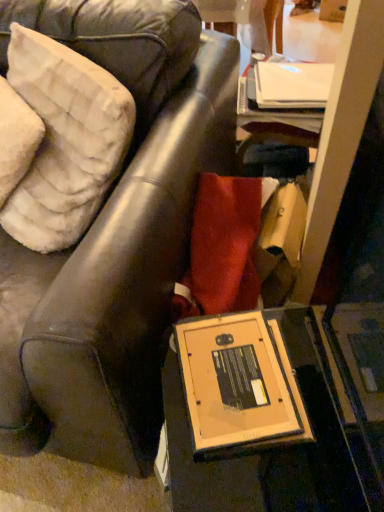
Question: Does white plush pillow at upper left, which is the 1th pillow from right to left, have a lesser width compared to white fluffy pillow at upper left, the second pillow when ordered from right to left?

Choices:
 (A) no
 (B) yes

Answer: (A)

Question: From the image's perspective, is white plush pillow at upper left, the second pillow in the left-to-right sequence, below white fluffy pillow at upper left, the first pillow viewed from the left?

Choices:
 (A) yes
 (B) no

Answer: (B)

Question: Does white plush pillow at upper left, which is the 1th pillow from right to left, lie behind white fluffy pillow at upper left, the first pillow viewed from the left?

Choices:
 (A) no
 (B) yes

Answer: (A)

Question: Are white plush pillow at upper left, the second pillow in the left-to-right sequence, and white fluffy pillow at upper left, the second pillow when ordered from right to left, making contact?

Choices:
 (A) no
 (B) yes

Answer: (B)

Question: Considering the relative sizes of white plush pillow at upper left, the second pillow in the left-to-right sequence, and white fluffy pillow at upper left, the first pillow viewed from the left, in the image provided, is white plush pillow at upper left, the second pillow in the left-to-right sequence, smaller than white fluffy pillow at upper left, the first pillow viewed from the left,?

Choices:
 (A) no
 (B) yes

Answer: (A)

Question: Is point (173, 223) positioned closer to the camera than point (39, 104)?

Choices:
 (A) closer
 (B) farther

Answer: (A)

Question: Considering the positions of matte brown leather chair at center and white plush pillow at upper left, the second pillow in the left-to-right sequence, in the image, is matte brown leather chair at center wider or thinner than white plush pillow at upper left, the second pillow in the left-to-right sequence,?

Choices:
 (A) thin
 (B) wide

Answer: (B)

Question: Is matte brown leather chair at center inside or outside of white plush pillow at upper left, which is the 1th pillow from right to left?

Choices:
 (A) outside
 (B) inside

Answer: (A)

Question: In the image, is matte brown leather chair at center on the left side or the right side of white plush pillow at upper left, which is the 1th pillow from right to left?

Choices:
 (A) right
 (B) left

Answer: (B)

Question: From the image's perspective, is white fluffy pillow at upper left, the first pillow viewed from the left, above or below white plush pillow at upper left, the second pillow in the left-to-right sequence?

Choices:
 (A) above
 (B) below

Answer: (B)

Question: Considering the positions of white fluffy pillow at upper left, the first pillow viewed from the left, and white plush pillow at upper left, the second pillow in the left-to-right sequence, in the image, is white fluffy pillow at upper left, the first pillow viewed from the left, taller or shorter than white plush pillow at upper left, the second pillow in the left-to-right sequence,?

Choices:
 (A) short
 (B) tall

Answer: (A)

Question: Would you say white fluffy pillow at upper left, the first pillow viewed from the left, is inside or outside white plush pillow at upper left, which is the 1th pillow from right to left?

Choices:
 (A) inside
 (B) outside

Answer: (A)

Question: Considering their positions, is white fluffy pillow at upper left, the first pillow viewed from the left, located in front of or behind white plush pillow at upper left, the second pillow in the left-to-right sequence?

Choices:
 (A) front
 (B) behind

Answer: (B)

Question: Is white plush pillow at upper left, the second pillow in the left-to-right sequence, in front of or behind white fluffy pillow at upper left, the first pillow viewed from the left, in the image?

Choices:
 (A) front
 (B) behind

Answer: (A)

Question: Is white plush pillow at upper left, the second pillow in the left-to-right sequence, wider or thinner than white fluffy pillow at upper left, the first pillow viewed from the left?

Choices:
 (A) wide
 (B) thin

Answer: (A)